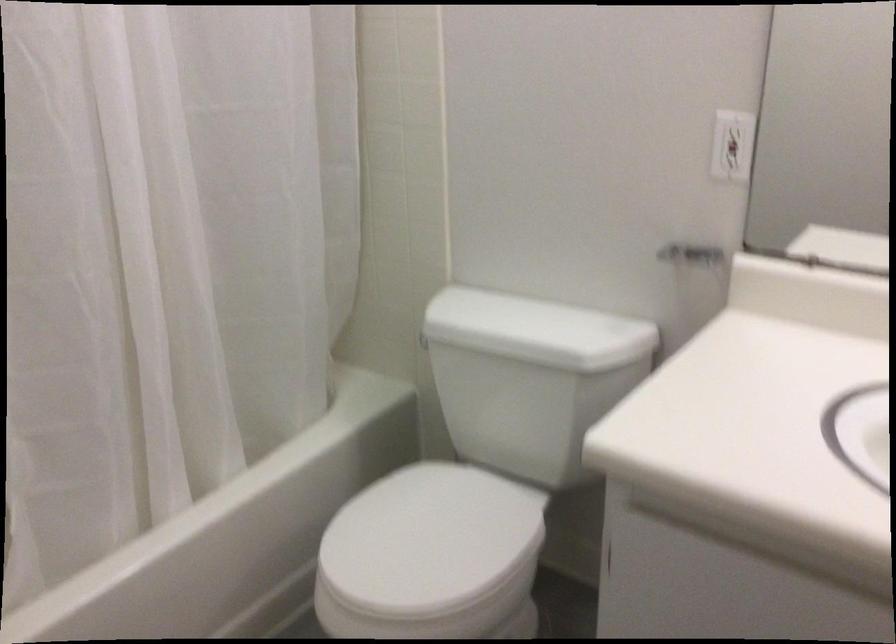
In order to click on white toilet seat in this screenshot , I will do `click(429, 540)`.